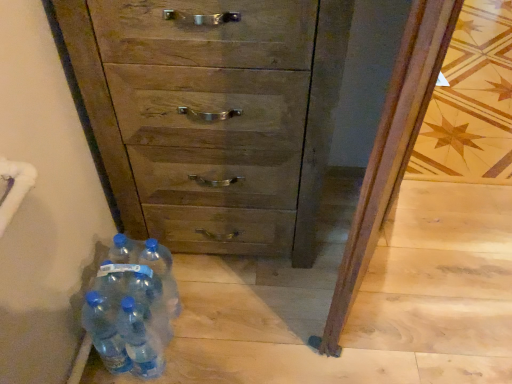
This screenshot has width=512, height=384. In order to click on vacant space behind transparent plastic bottles at lower left, the fourth bottle viewed from the left in this screenshot , I will do `click(195, 281)`.